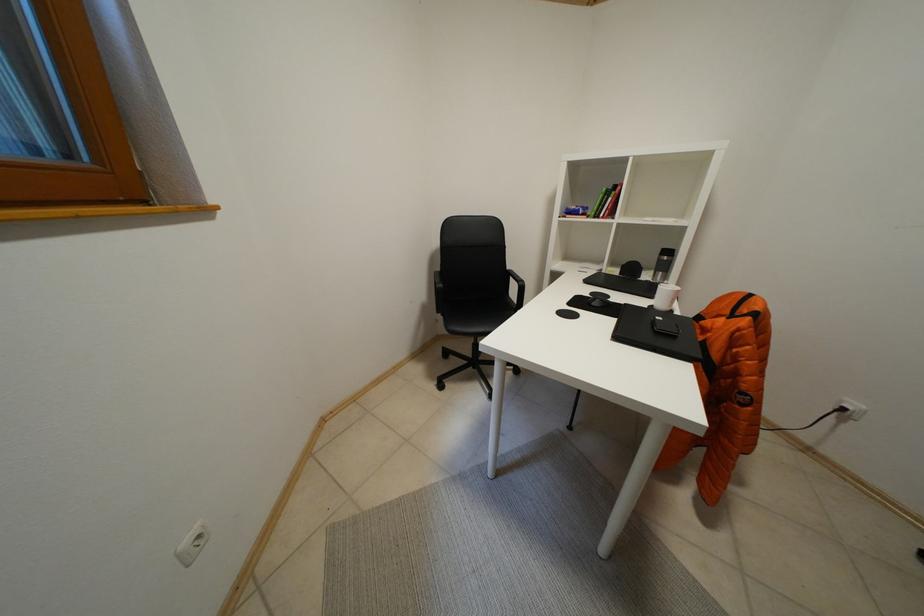
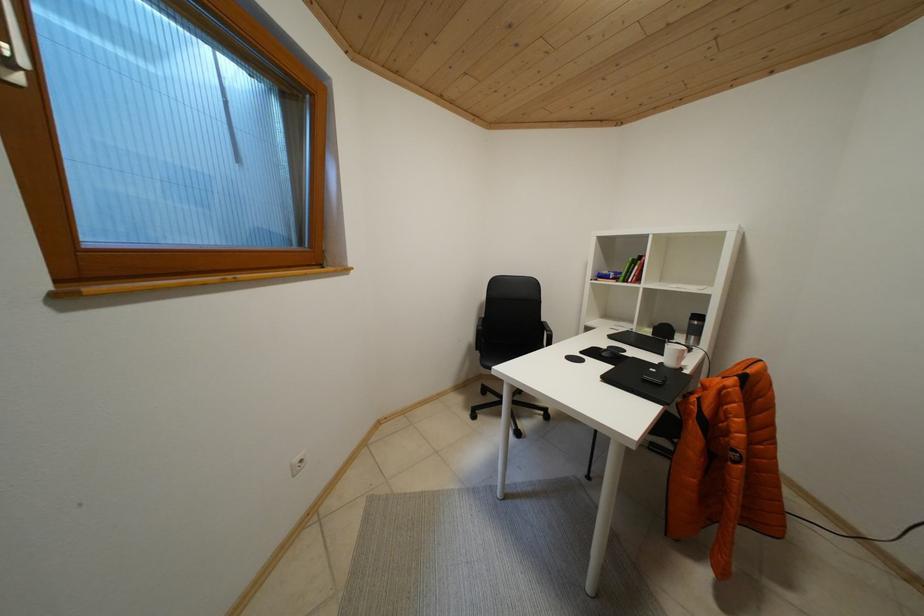
Question: The camera is either moving clockwise (left) or counter-clockwise (right) around the object. The first image is from the beginning of the video and the second image is from the end. Is the camera moving left or right when shooting the video?

Choices:
 (A) Left
 (B) Right

Answer: (B)